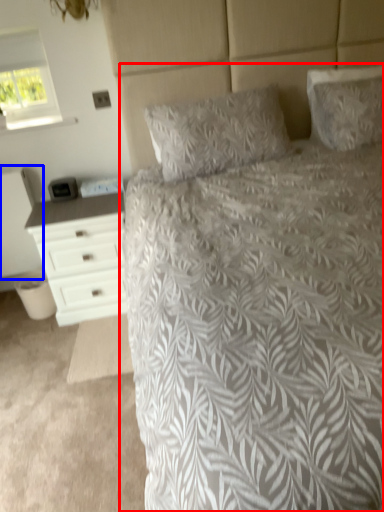
Question: Which point is closer to the camera, bed (highlighted by a red box) or nightstand (highlighted by a blue box)?

Choices:
 (A) bed
 (B) nightstand

Answer: (A)